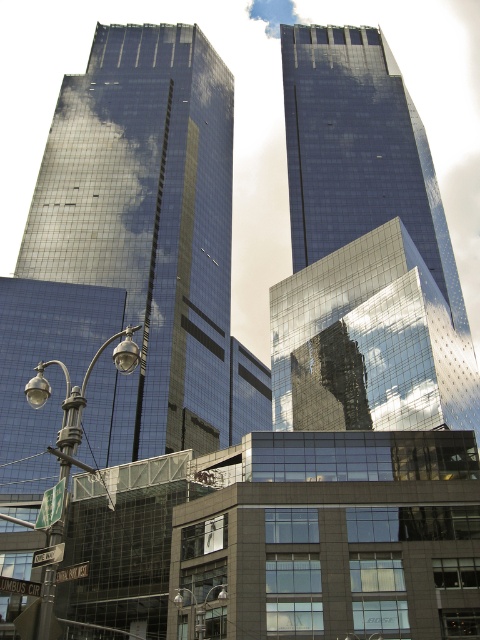
Question: Which of these objects is positioned farthest from the shiny glass skyscraper at center?

Choices:
 (A) metallic silver streetlight at lower center
 (B) shiny glass skyscraper at upper center
 (C) polished metal streetlight at lower left

Answer: (A)

Question: Does shiny glass skyscraper at upper center have a greater width compared to metallic silver streetlight at lower center?

Choices:
 (A) yes
 (B) no

Answer: (A)

Question: Where is shiny glass skyscraper at center located in relation to polished metal streetlight at lower left in the image?

Choices:
 (A) below
 (B) above

Answer: (B)

Question: Can you confirm if shiny glass skyscraper at center is smaller than metallic silver streetlight at lower center?

Choices:
 (A) yes
 (B) no

Answer: (B)

Question: Among these points, which one is nearest to the camera?

Choices:
 (A) (168, 262)
 (B) (67, 465)

Answer: (B)

Question: Which of the following is the farthest from the observer?

Choices:
 (A) metallic silver streetlight at lower center
 (B) shiny glass skyscraper at upper center
 (C) shiny glass skyscraper at center
 (D) polished metal streetlight at lower left

Answer: (C)